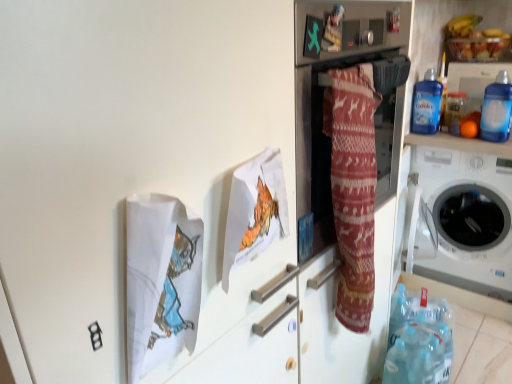
Where is `vacant space in front of orange matte at upper right`? vacant space in front of orange matte at upper right is located at coordinates (x=487, y=140).